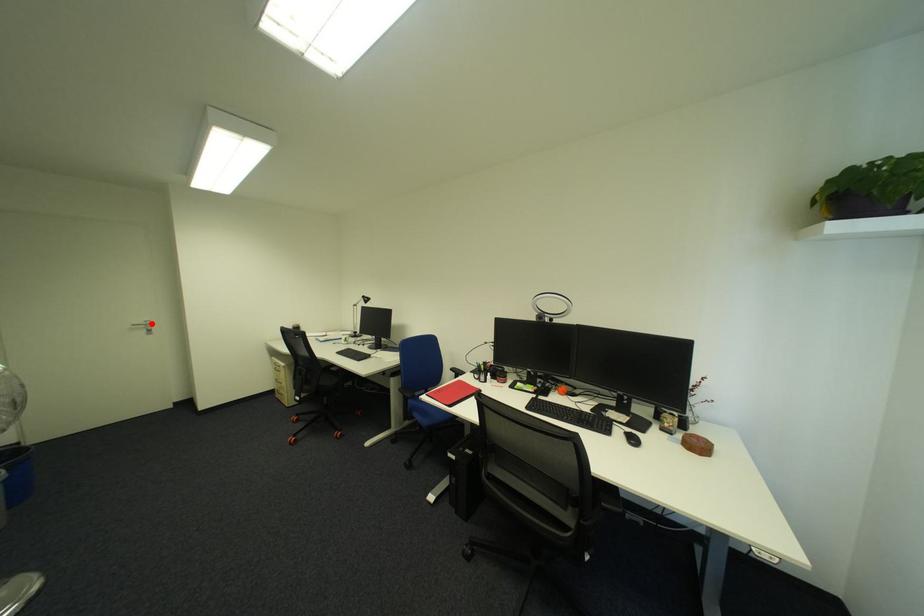
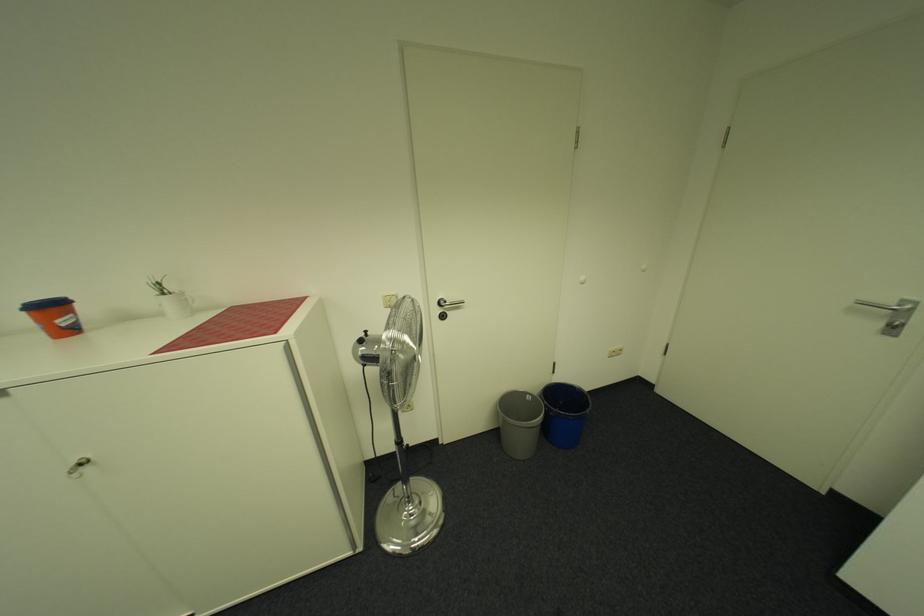
Locate, in the second image, the point that corresponds to the highlighted location in the first image.

(898, 302)